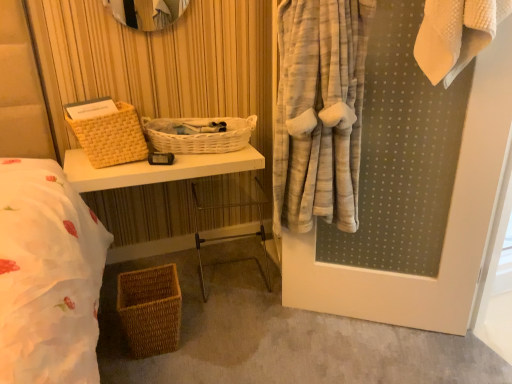
Find the location of a particular element. The width and height of the screenshot is (512, 384). vacant point to the right of woven brown basket at lower left, marked as the first basket in a bottom-to-top arrangement is located at coordinates (205, 340).